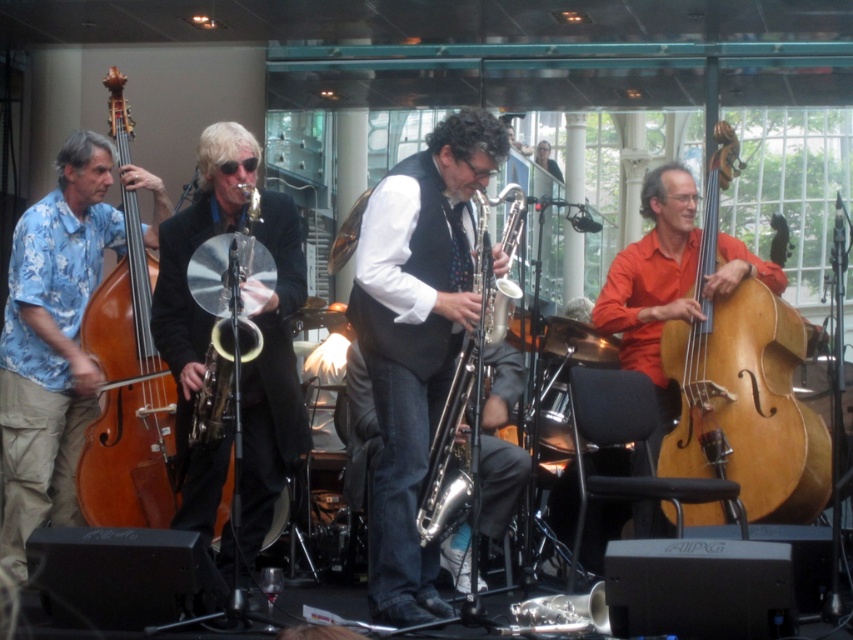
You are a photographer positioned at the front row of the jazz performance. You want to take a photo where both the shiny silver saxophone at center and the wooden polished cello at center are clearly visible. Which instrument will appear larger in your photo?

The shiny silver saxophone at center will appear larger in the photo because it is closer to the viewer than the wooden polished cello at center.

You are standing at the center of the stage and want to move to the natural wood cello at right. Which direction should you move to reach it?

The natural wood cello at right is located at point 0.600 on the x axis and 0.872 on the y axis. Since you are at the center, you should move to the right and slightly forward to reach it.